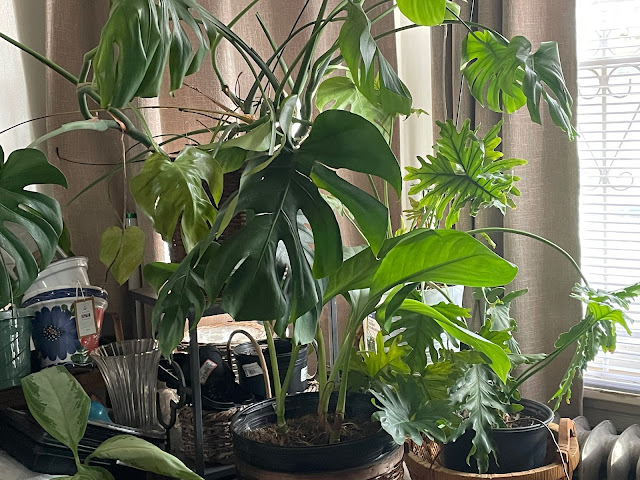
This screenshot has width=640, height=480. Find the location of `window`. window is located at coordinates tap(621, 227).